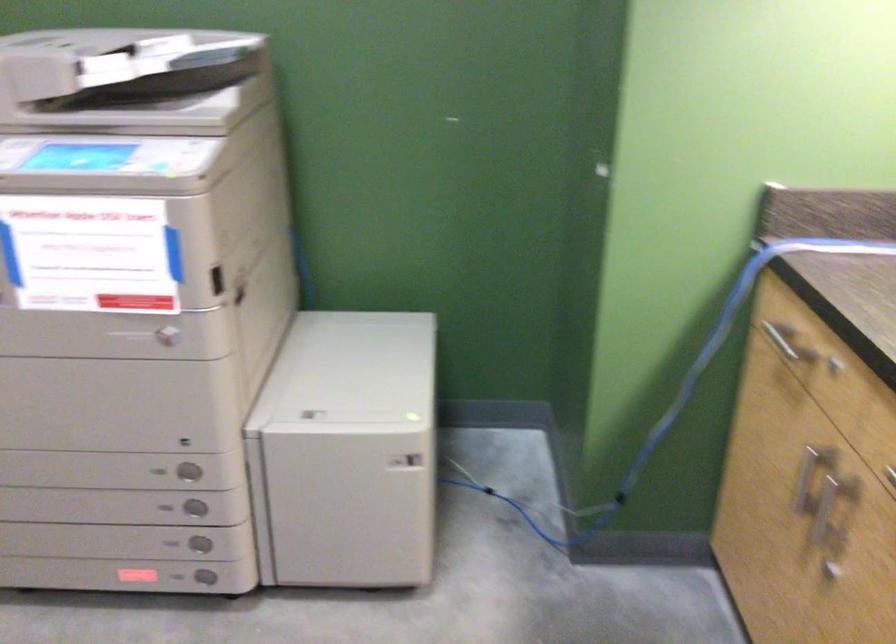
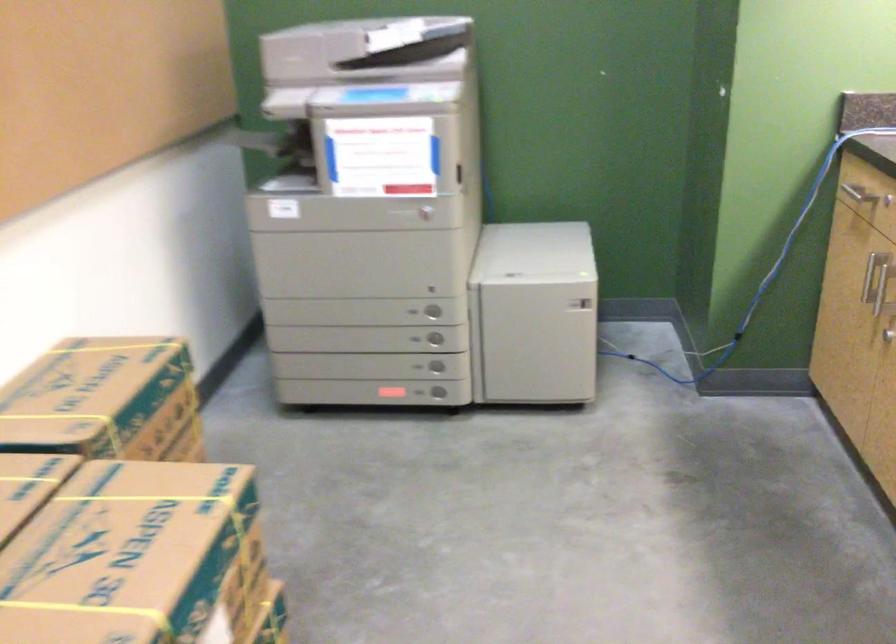
Question: In a continuous first-person perspective shot, in which direction is the camera moving?

Choices:
 (A) Left
 (B) Right
 (C) Forward
 (D) Backward

Answer: (D)